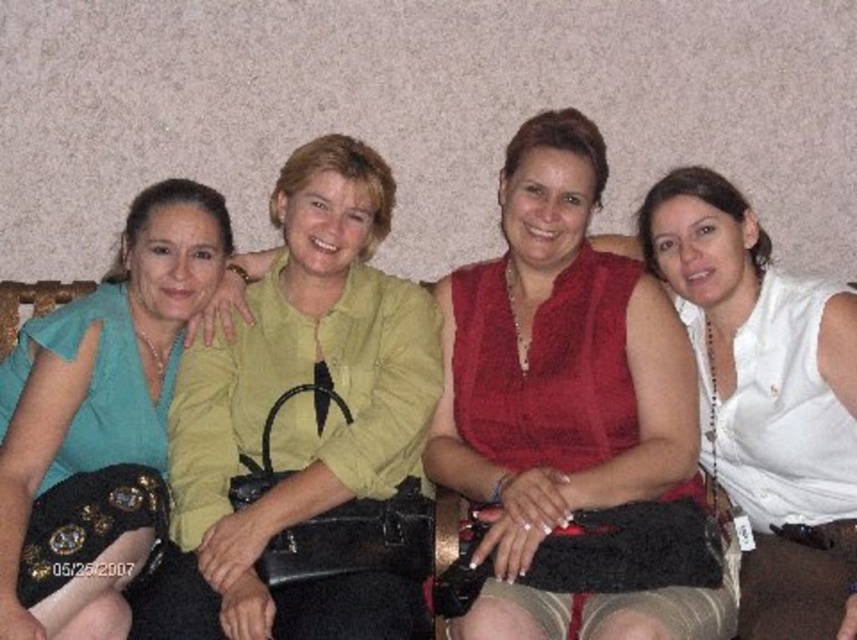
You are a photographer trying to capture a candid shot of the two women in the image. You notice the matte red blouse at center and the teal fabric dress at left. Which one is positioned to the right of the other?

The matte red blouse at center is positioned to the right of the teal fabric dress at left.

You are a fashion designer observing the group of women. You notice two tops at the center of the image. Which top is taller between the matte red blouse at center and the white matte tank top at center?

The matte red blouse at center is taller than the white matte tank top at center.